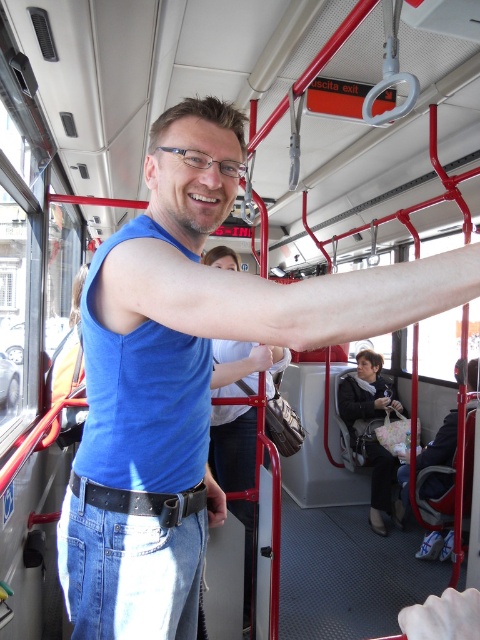
Question: Does slightly pinkish skin at upper center appear under matte black arm at lower center?

Choices:
 (A) yes
 (B) no

Answer: (B)

Question: Among these points, which one is nearest to the camera?

Choices:
 (A) (285, 328)
 (B) (261, 362)

Answer: (A)

Question: Does matte black belt at lower center appear on the right side of matte blue shirt at center?

Choices:
 (A) no
 (B) yes

Answer: (A)

Question: Which point is closer to the camera?

Choices:
 (A) (384, 403)
 (B) (392, 401)
 (C) (220, 506)
 (D) (255, 362)

Answer: (C)

Question: Does slightly pinkish skin at upper center appear on the left side of matte black belt at lower center?

Choices:
 (A) no
 (B) yes

Answer: (A)

Question: Estimate the real-world distances between objects in this image. Which object is farther from the matte blue shirt at center?

Choices:
 (A) matte black belt at lower center
 (B) black leather belt at center

Answer: (B)